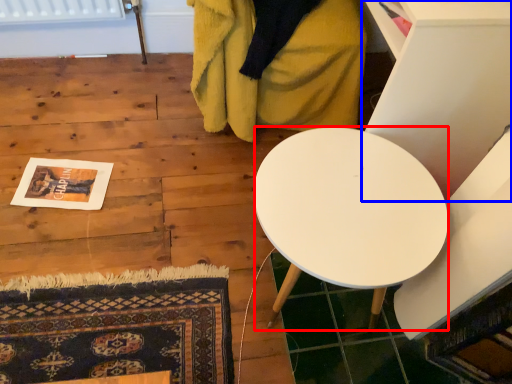
Question: Which object appears farthest to the camera in this image, desk (highlighted by a red box) or furniture (highlighted by a blue box)?

Choices:
 (A) desk
 (B) furniture

Answer: (B)